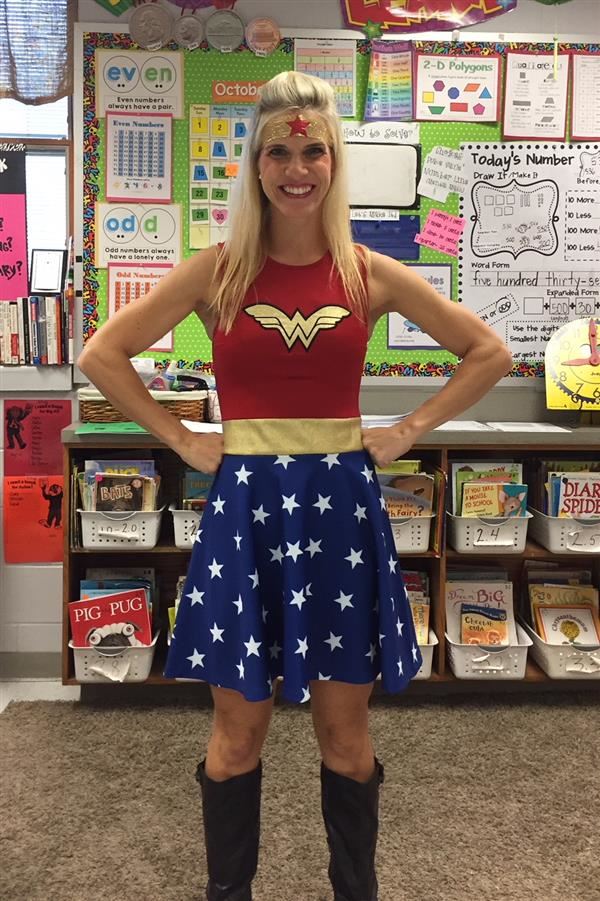
At what (x,y) coordinates should I click in order to perform the action: click on wall. Please return your answer as a coordinate pair (x, y). The width and height of the screenshot is (600, 901). Looking at the image, I should click on click(316, 12).